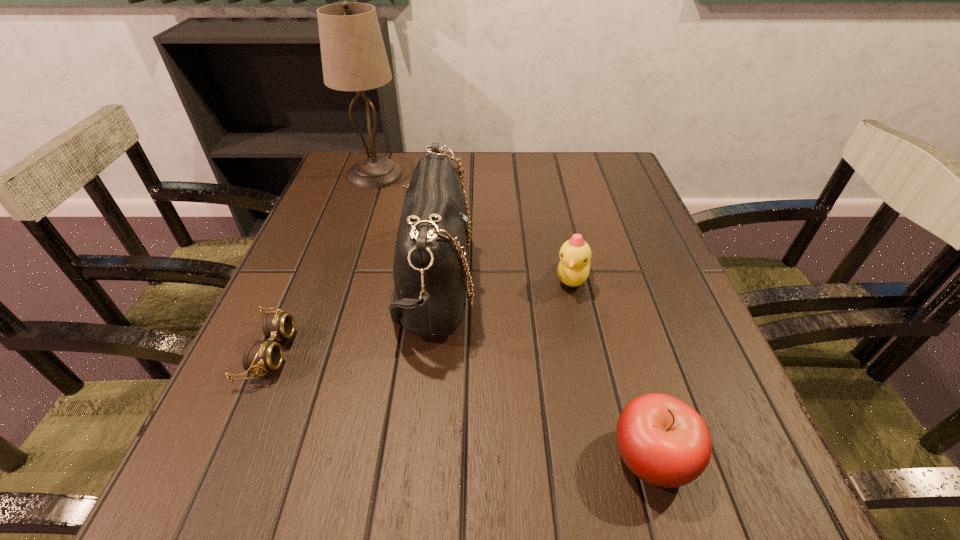
Identify the location of blank region between the duckling and the lampshade. The width and height of the screenshot is (960, 540). (473, 226).

This screenshot has width=960, height=540. I want to click on vacant area that lies between the shortest object and the apple, so click(461, 404).

The height and width of the screenshot is (540, 960). Identify the location of free space between the duckling and the apple. (612, 368).

Locate which object ranks fourth in proximity to the duckling. Please provide its 2D coordinates. Your answer should be formatted as a tuple, i.e. [(x, y)], where the tuple contains the x and y coordinates of a point satisfying the conditions above.

[(259, 356)]

I want to click on object that can be found as the second closest to the lampshade, so click(259, 356).

What are the coordinates of `vacant region that satisfies the following two spatial constraints: 1. on the front-facing side of the duckling; 2. on the right side of the nearest object` in the screenshot? It's located at (612, 457).

This screenshot has height=540, width=960. Find the location of `vacant region that satisfies the following two spatial constraints: 1. at the front of the fourth shortest object with chain and zipper; 2. on the back side of the nearest object`. vacant region that satisfies the following two spatial constraints: 1. at the front of the fourth shortest object with chain and zipper; 2. on the back side of the nearest object is located at coordinates (415, 457).

The image size is (960, 540). I want to click on vacant region that satisfies the following two spatial constraints: 1. on the front-facing side of the apple; 2. on the left side of the duckling, so click(x=612, y=457).

Find the location of a particular element. vacant area in the image that satisfies the following two spatial constraints: 1. at the front of the third object from left to right with chain and zipper; 2. on the right side of the apple is located at coordinates (415, 457).

The image size is (960, 540). Identify the location of free space that satisfies the following two spatial constraints: 1. through the lenses of the shortest object; 2. on the right side of the nearest object. (225, 457).